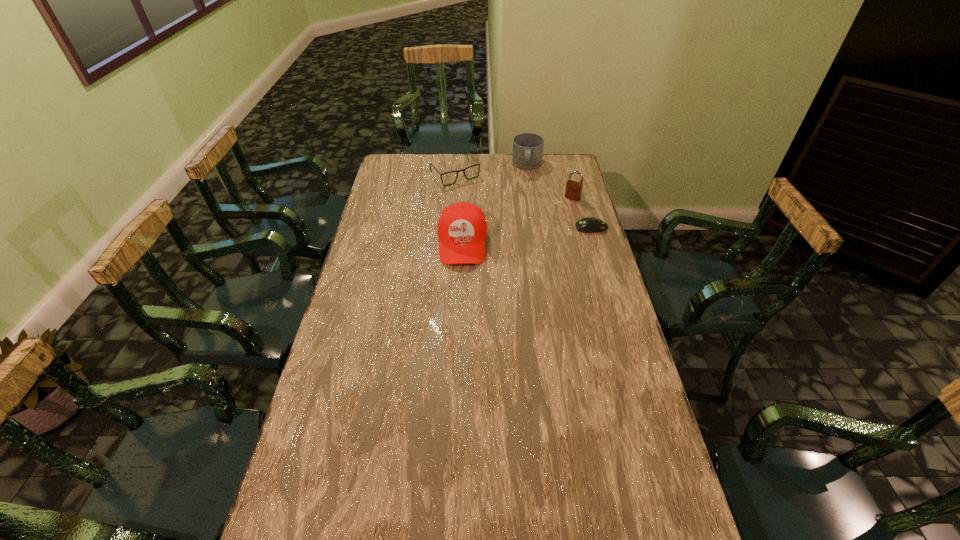
The image size is (960, 540). In order to click on object positioned at the far right corner in this screenshot , I will do `click(527, 153)`.

In the image, there is a desktop. Identify the location of free space at the far edge. The width and height of the screenshot is (960, 540). (436, 172).

Identify the location of vacant space at the near edge of the desktop. (565, 505).

Identify the location of free region at the left edge of the desktop. The image size is (960, 540). (341, 460).

Locate an element on the screen. This screenshot has height=540, width=960. vacant space at the right edge of the desktop is located at coordinates (547, 192).

Image resolution: width=960 pixels, height=540 pixels. In the image, there is a desktop. Find the location of `vacant space at the far left corner`. vacant space at the far left corner is located at coordinates (416, 170).

Find the location of a particular element. The image size is (960, 540). free point at the near right corner is located at coordinates (622, 520).

At what (x,y) coordinates should I click in order to perform the action: click on unoccupied area between the mug and the spectacles. Please return your answer as a coordinate pair (x, y). Image resolution: width=960 pixels, height=540 pixels. Looking at the image, I should click on (492, 170).

The height and width of the screenshot is (540, 960). What are the coordinates of `free space that is in between the mug and the baseball cap` in the screenshot? It's located at (494, 204).

Locate an element on the screen. This screenshot has width=960, height=540. unoccupied position between the spectacles and the computer mouse is located at coordinates (x=523, y=201).